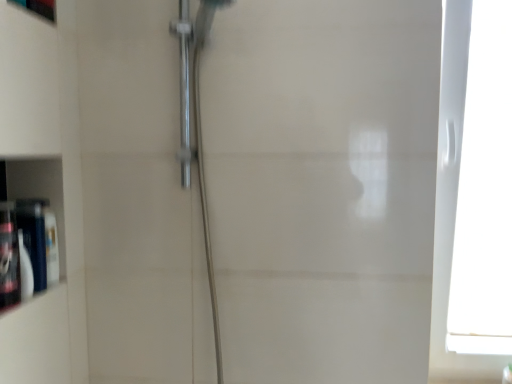
Question: Is white plastic window at right to the left of matte black bottle at left, the 1th toiletry when ordered from back to front, from the viewer's perspective?

Choices:
 (A) yes
 (B) no

Answer: (B)

Question: Considering the relative sizes of white plastic window at right and matte black bottle at left, the 1th toiletry when ordered from back to front, in the image provided, is white plastic window at right thinner than matte black bottle at left, the 1th toiletry when ordered from back to front,?

Choices:
 (A) yes
 (B) no

Answer: (B)

Question: Considering the relative sizes of white plastic window at right and matte black bottle at left, acting as the 2th toiletry starting from the front, in the image provided, is white plastic window at right taller than matte black bottle at left, acting as the 2th toiletry starting from the front,?

Choices:
 (A) yes
 (B) no

Answer: (A)

Question: Is white plastic window at right turned away from matte black bottle at left, acting as the 2th toiletry starting from the front?

Choices:
 (A) no
 (B) yes

Answer: (A)

Question: Does white plastic window at right have a smaller size compared to matte black bottle at left, the 1th toiletry when ordered from back to front?

Choices:
 (A) yes
 (B) no

Answer: (B)

Question: In the image, is matte white cabinet at left positioned in front of or behind translucent plastic bottle at left, the second toiletry viewed from the back?

Choices:
 (A) front
 (B) behind

Answer: (B)

Question: Which is correct: matte white cabinet at left is inside translucent plastic bottle at left, the second toiletry viewed from the back, or outside of it?

Choices:
 (A) outside
 (B) inside

Answer: (A)

Question: From the image's perspective, is matte white cabinet at left positioned above or below translucent plastic bottle at left, the second toiletry viewed from the back?

Choices:
 (A) above
 (B) below

Answer: (A)

Question: Visually, is matte white cabinet at left positioned to the left or to the right of translucent plastic bottle at left, acting as the 1th toiletry starting from the front?

Choices:
 (A) right
 (B) left

Answer: (B)

Question: Based on their positions, is matte black bottle at left, the 1th toiletry when ordered from back to front, located to the left or right of translucent plastic bottle at left, the second toiletry viewed from the back?

Choices:
 (A) right
 (B) left

Answer: (A)

Question: Is matte black bottle at left, acting as the 2th toiletry starting from the front, taller or shorter than translucent plastic bottle at left, acting as the 1th toiletry starting from the front?

Choices:
 (A) tall
 (B) short

Answer: (B)

Question: Considering the positions of point (33, 236) and point (12, 218), is point (33, 236) closer or farther from the camera than point (12, 218)?

Choices:
 (A) farther
 (B) closer

Answer: (A)

Question: From the image's perspective, relative to translucent plastic bottle at left, acting as the 1th toiletry starting from the front, is matte black bottle at left, the 1th toiletry when ordered from back to front, above or below?

Choices:
 (A) above
 (B) below

Answer: (A)

Question: Would you say translucent plastic bottle at left, the second toiletry viewed from the back, is inside or outside matte black bottle at left, the 1th toiletry when ordered from back to front?

Choices:
 (A) outside
 (B) inside

Answer: (A)

Question: Considering the positions of translucent plastic bottle at left, the second toiletry viewed from the back, and matte black bottle at left, the 1th toiletry when ordered from back to front, in the image, is translucent plastic bottle at left, the second toiletry viewed from the back, bigger or smaller than matte black bottle at left, the 1th toiletry when ordered from back to front,?

Choices:
 (A) big
 (B) small

Answer: (A)